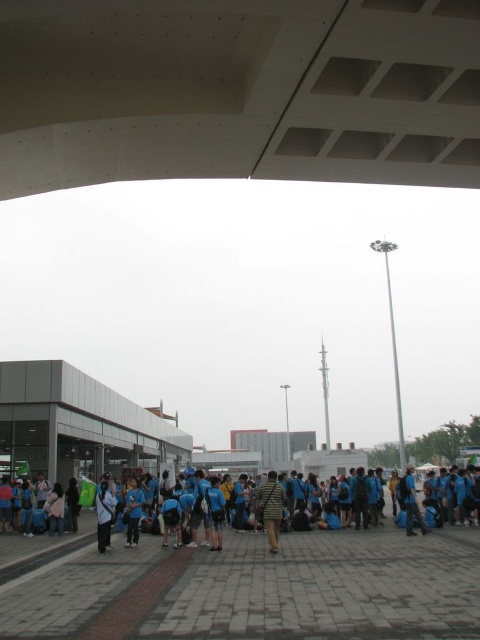
Question: Does striped fabric shirt at center appear over dark blue shirt at center?

Choices:
 (A) yes
 (B) no

Answer: (A)

Question: Can you confirm if blue fabric shirt at center is positioned to the right of light blue fabric jacket at center?

Choices:
 (A) yes
 (B) no

Answer: (A)

Question: Which of the following is the closest to the observer?

Choices:
 (A) (268, 499)
 (B) (34, 541)
 (C) (132, 534)
 (D) (110, 516)

Answer: (A)

Question: Which of the following is the closest to the observer?

Choices:
 (A) click(96, 502)
 (B) click(268, 488)
 (C) click(135, 522)
 (D) click(468, 540)

Answer: (B)

Question: Which point is farther to the camera?

Choices:
 (A) (15, 541)
 (B) (267, 538)
 (C) (108, 486)
 (D) (131, 513)

Answer: (A)

Question: Does blue fabric shirt at center appear under light blue fabric jacket at center?

Choices:
 (A) no
 (B) yes

Answer: (B)